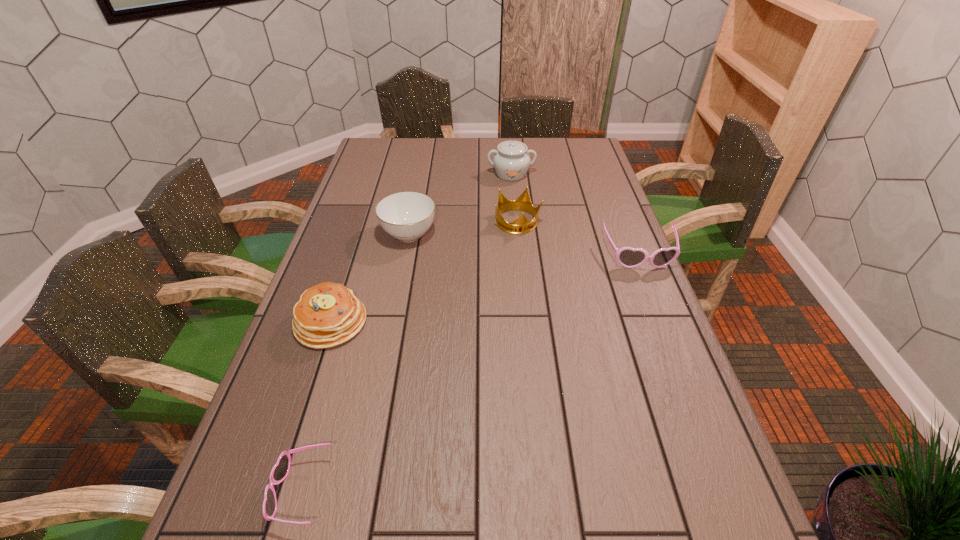
Image resolution: width=960 pixels, height=540 pixels. Identify the location of vacant area situated on the front-facing side of the nearer sunglasses. (243, 491).

Where is `vacant space located on the front-facing side of the nearer sunglasses`? This screenshot has height=540, width=960. vacant space located on the front-facing side of the nearer sunglasses is located at coordinates (232, 491).

Image resolution: width=960 pixels, height=540 pixels. Find the location of `vacant space located 0.400m on the front-facing side of the rightmost object`. vacant space located 0.400m on the front-facing side of the rightmost object is located at coordinates (695, 395).

I want to click on vacant space located on the back of the crown, so click(512, 166).

Find the location of a particular element. vacant space located 0.200m on the front of the tallest object is located at coordinates 516,215.

At what (x,y) coordinates should I click in order to perform the action: click on free region located 0.080m on the front of the left chinaware. Please return your answer as a coordinate pair (x, y). The height and width of the screenshot is (540, 960). Looking at the image, I should click on (402, 271).

This screenshot has height=540, width=960. I want to click on free spot located on the front of the pancake, so click(283, 468).

The width and height of the screenshot is (960, 540). Identify the location of object at the far edge. (511, 162).

Image resolution: width=960 pixels, height=540 pixels. What are the coordinates of `object at the near edge` in the screenshot? It's located at (280, 470).

What are the coordinates of `sunglasses present at the left edge` in the screenshot? It's located at (280, 470).